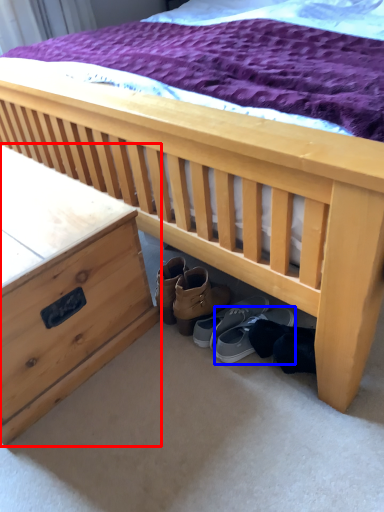
Question: Which object is further to the camera taking this photo, nightstand (highlighted by a red box) or footwear (highlighted by a blue box)?

Choices:
 (A) nightstand
 (B) footwear

Answer: (B)